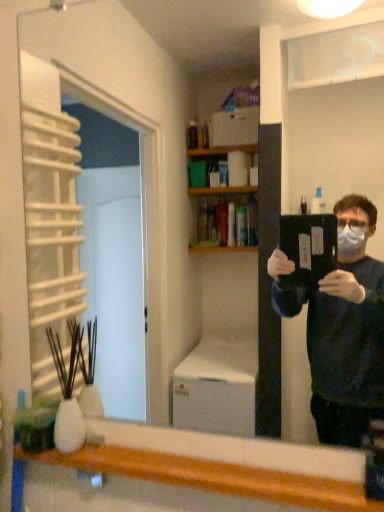
Image resolution: width=384 pixels, height=512 pixels. In order to click on free point above wooden ledge at lower center (from a real-world perspective) in this screenshot , I will do `click(190, 464)`.